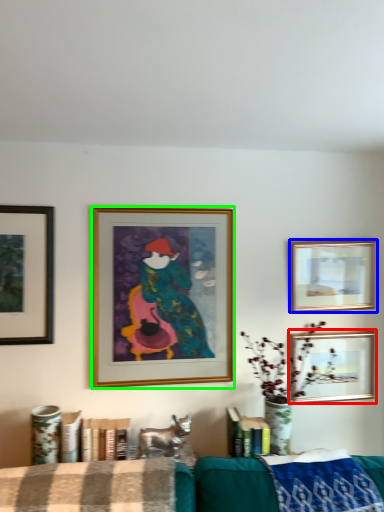
Question: Which object is the closest to the picture frame (highlighted by a red box)? Choose among these: picture frame (highlighted by a blue box) or picture frame (highlighted by a green box).

Choices:
 (A) picture frame
 (B) picture frame

Answer: (A)